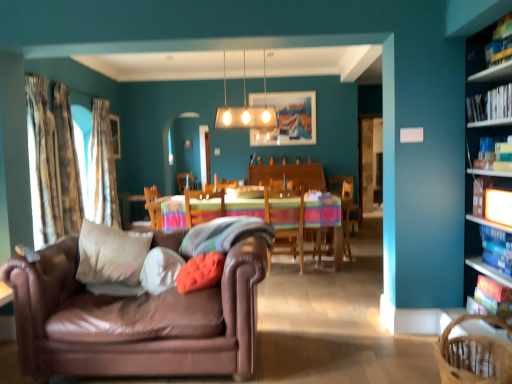
Question: Is hardcover book at upper right, placed as the third book when sorted from top to bottom, far from textured beige curtain at left, which ranks as the 2th curtain in front-to-back order?

Choices:
 (A) yes
 (B) no

Answer: (A)

Question: Does hardcover book at upper right, acting as the 3th book starting from the bottom, have a lesser height compared to textured beige curtain at left, which is the second curtain from back to front?

Choices:
 (A) no
 (B) yes

Answer: (B)

Question: Is hardcover book at upper right, placed as the third book when sorted from top to bottom, outside textured beige curtain at left, which is the second curtain from back to front?

Choices:
 (A) yes
 (B) no

Answer: (A)

Question: Is hardcover book at upper right, placed as the third book when sorted from top to bottom, touching textured beige curtain at left, which is the second curtain from back to front?

Choices:
 (A) yes
 (B) no

Answer: (B)

Question: Is hardcover book at upper right, acting as the 3th book starting from the bottom, positioned behind textured beige curtain at left, which is the second curtain from back to front?

Choices:
 (A) yes
 (B) no

Answer: (B)

Question: From the image's perspective, is hardcover book at upper right, placed as the third book when sorted from top to bottom, on textured beige curtain at left, which ranks as the 2th curtain in front-to-back order?

Choices:
 (A) no
 (B) yes

Answer: (A)

Question: Would you say white soft cushion at center, which is the 1th pillow from left to right, is part of wooden chair at center, positioned as the 1th chair in left-to-right order,'s contents?

Choices:
 (A) yes
 (B) no

Answer: (B)

Question: Are wooden chair at center, positioned as the 1th chair in left-to-right order, and white soft cushion at center, which is the 1th pillow from left to right, far apart?

Choices:
 (A) yes
 (B) no

Answer: (A)

Question: Is the depth of wooden chair at center, positioned as the 2th chair in right-to-left order, greater than that of white soft cushion at center, which is the 1th pillow from left to right?

Choices:
 (A) no
 (B) yes

Answer: (B)

Question: Can you confirm if wooden chair at center, positioned as the 1th chair in left-to-right order, is taller than white soft cushion at center, the fourth pillow when ordered from right to left?

Choices:
 (A) no
 (B) yes

Answer: (B)

Question: From the image's perspective, is wooden chair at center, positioned as the 1th chair in left-to-right order, located above white soft cushion at center, which is the 1th pillow from left to right?

Choices:
 (A) yes
 (B) no

Answer: (A)

Question: Is wooden chair at center, positioned as the 2th chair in right-to-left order, positioned beyond the bounds of white soft cushion at center, which is the 1th pillow from left to right?

Choices:
 (A) yes
 (B) no

Answer: (A)

Question: Does hardcover book at right, which appears as the 1th book when ordered from the bottom, contain velvety orange pillow at center, the 4th pillow in the left-to-right sequence?

Choices:
 (A) yes
 (B) no

Answer: (B)